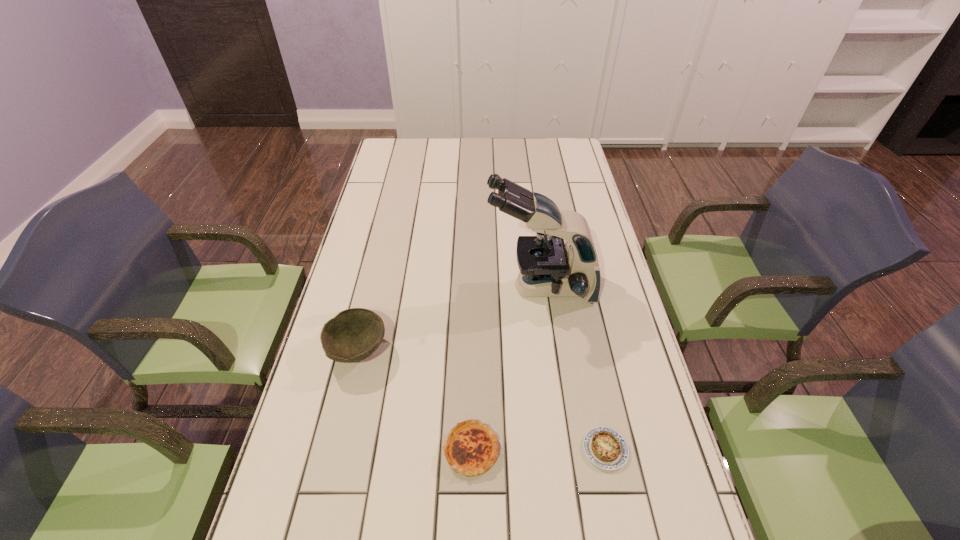
I want to click on free area in between the bowl and the shorter quiche, so click(x=481, y=400).

Identify which object is located as the second nearest to the bowl. Please provide its 2D coordinates. Your answer should be formatted as a tuple, i.e. [(x, y)], where the tuple contains the x and y coordinates of a point satisfying the conditions above.

[(548, 268)]

Where is `object that is the third closest one to the leftmost object`? The image size is (960, 540). object that is the third closest one to the leftmost object is located at coordinates tap(606, 448).

The height and width of the screenshot is (540, 960). Identify the location of free location that satisfies the following two spatial constraints: 1. through the eyepieces of the farthest object; 2. on the right side of the right quiche. (562, 449).

At what (x,y) coordinates should I click in order to perform the action: click on vacant space that satisfies the following two spatial constraints: 1. through the eyepieces of the farthest object; 2. on the front side of the left quiche. Please return your answer as a coordinate pair (x, y). Looking at the image, I should click on (562, 450).

Find the location of `free space that satisfies the following two spatial constraints: 1. on the front side of the bowl; 2. on the left side of the left quiche`. free space that satisfies the following two spatial constraints: 1. on the front side of the bowl; 2. on the left side of the left quiche is located at coordinates (333, 450).

The width and height of the screenshot is (960, 540). I want to click on blank space that satisfies the following two spatial constraints: 1. on the front side of the left quiche; 2. on the left side of the bowl, so click(333, 450).